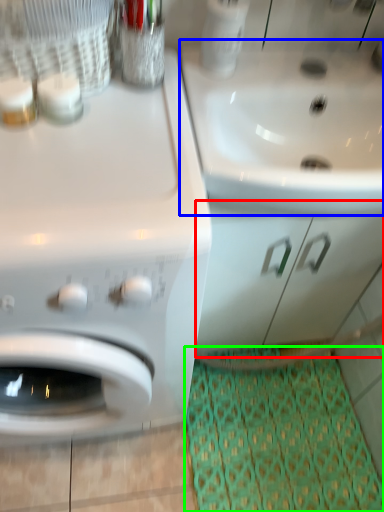
Question: Estimate the real-world distances between objects in this image. Which object is closer to drawer (highlighted by a red box), sink (highlighted by a blue box) or doormat (highlighted by a green box)?

Choices:
 (A) sink
 (B) doormat

Answer: (A)